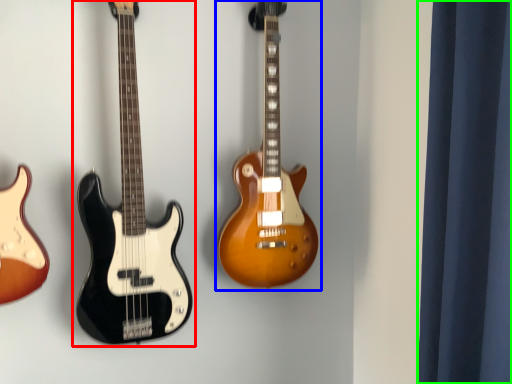
Question: Which object is positioned farthest from guitar (highlighted by a red box)? Select from guitar (highlighted by a blue box) and curtain (highlighted by a green box).

Choices:
 (A) guitar
 (B) curtain

Answer: (B)